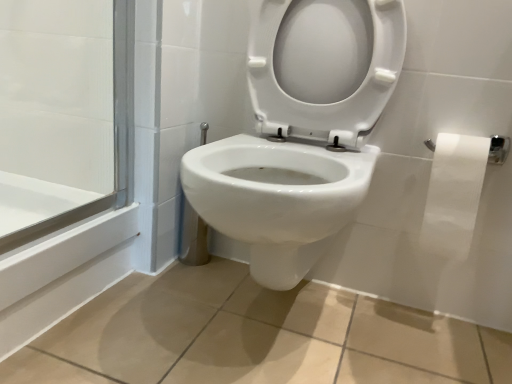
Question: Would you say white glossy toilet at center is outside white paper at right?

Choices:
 (A) yes
 (B) no

Answer: (A)

Question: Considering the relative sizes of white glossy toilet at center and white paper at right in the image provided, is white glossy toilet at center wider than white paper at right?

Choices:
 (A) yes
 (B) no

Answer: (A)

Question: Is there a large distance between white glossy toilet at center and white paper at right?

Choices:
 (A) no
 (B) yes

Answer: (A)

Question: Can you confirm if white glossy toilet at center is smaller than white paper at right?

Choices:
 (A) no
 (B) yes

Answer: (A)

Question: Is white glossy toilet at center to the right of white paper at right from the viewer's perspective?

Choices:
 (A) yes
 (B) no

Answer: (B)

Question: Does white glossy toilet at center turn towards white paper at right?

Choices:
 (A) no
 (B) yes

Answer: (A)

Question: Is white paper at right not within white glossy toilet at center?

Choices:
 (A) no
 (B) yes

Answer: (B)

Question: Is white paper at right at the left side of white glossy toilet at center?

Choices:
 (A) no
 (B) yes

Answer: (A)

Question: From a real-world perspective, is white paper at right on top of white glossy toilet at center?

Choices:
 (A) yes
 (B) no

Answer: (B)

Question: Is white paper at right thinner than white glossy toilet at center?

Choices:
 (A) no
 (B) yes

Answer: (B)

Question: Considering the relative sizes of white paper at right and white glossy toilet at center in the image provided, is white paper at right shorter than white glossy toilet at center?

Choices:
 (A) yes
 (B) no

Answer: (A)

Question: Does white paper at right turn towards white glossy toilet at center?

Choices:
 (A) no
 (B) yes

Answer: (A)

Question: Is white glossy toilet at center in front of or behind white paper at right in the image?

Choices:
 (A) front
 (B) behind

Answer: (A)